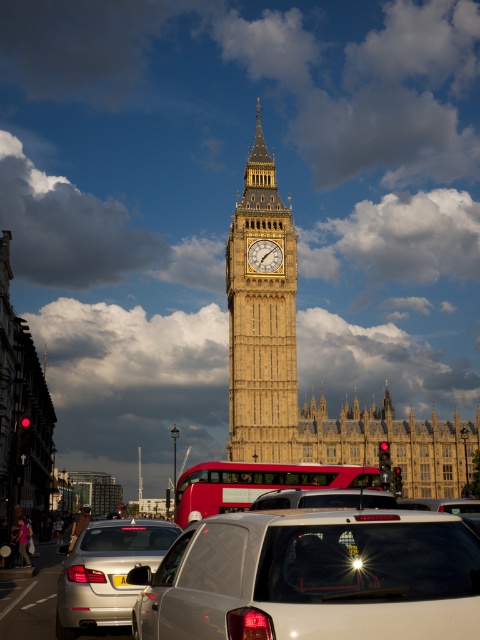
Question: Is silver metallic sedan at lower left above silver metallic suv at center?

Choices:
 (A) no
 (B) yes

Answer: (A)

Question: Can you confirm if silver metallic car at center is wider than red rubber double-decker bus at center?

Choices:
 (A) no
 (B) yes

Answer: (B)

Question: Estimate the real-world distances between objects in this image. Which object is closer to the silver metallic sedan at lower left?

Choices:
 (A) yellow plastic license plate at center
 (B) red rubber double-decker bus at center
 (C) gold textured clock at center
 (D) golden stone clock tower at center

Answer: (A)

Question: Which of the following is the farthest from the observer?

Choices:
 (A) gold textured clock at center
 (B) silver metallic car at center
 (C) silver metallic sedan at lower left

Answer: (A)

Question: Among these objects, which one is nearest to the camera?

Choices:
 (A) silver metallic car at center
 (B) silver metallic sedan at lower left

Answer: (A)

Question: Can you confirm if silver metallic sedan at lower left is positioned above silver metallic suv at center?

Choices:
 (A) no
 (B) yes

Answer: (A)